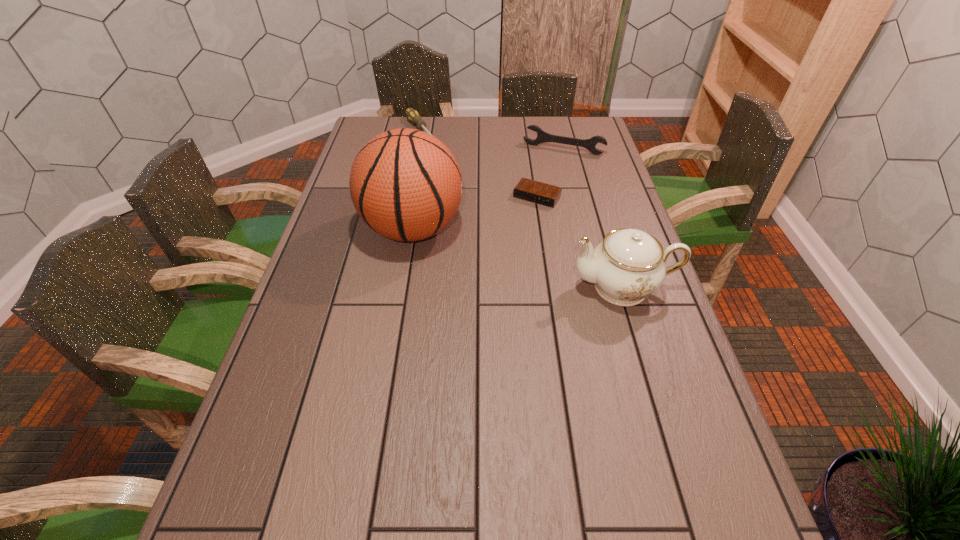
Locate an element on the screen. Image resolution: width=960 pixels, height=540 pixels. basketball is located at coordinates (405, 184).

Locate an element on the screen. This screenshot has width=960, height=540. chinaware is located at coordinates point(628,265).

Image resolution: width=960 pixels, height=540 pixels. In order to click on screwdriver in this screenshot , I will do pos(413,116).

Find the location of `wrench`. wrench is located at coordinates (542, 136).

The height and width of the screenshot is (540, 960). In order to click on alarm clock in this screenshot , I will do `click(544, 194)`.

The height and width of the screenshot is (540, 960). I want to click on free space located 0.280m on the side where the inflation valve is located, so pos(558,229).

What are the coordinates of `free space located at the spout of the fourth shortest object` in the screenshot? It's located at point(486,287).

Where is `free space located 0.120m at the spout of the fourth shortest object`? This screenshot has width=960, height=540. free space located 0.120m at the spout of the fourth shortest object is located at coordinates (524, 287).

Find the location of `free space located at the spout of the fourth shortest object`. free space located at the spout of the fourth shortest object is located at coordinates (513, 287).

Where is `vacant area situated 0.290m at the tip of the screwdriver`? vacant area situated 0.290m at the tip of the screwdriver is located at coordinates (461, 185).